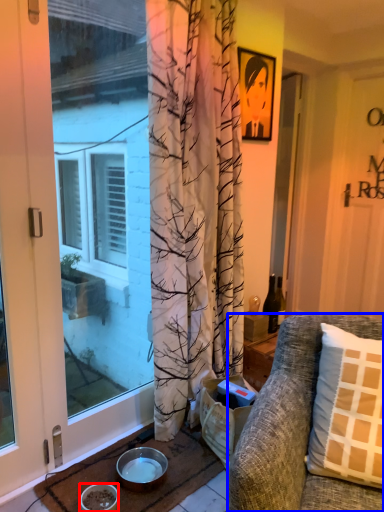
Question: Which object appears closest to the camera in this image, bowl (highlighted by a red box) or studio couch (highlighted by a blue box)?

Choices:
 (A) bowl
 (B) studio couch

Answer: (B)